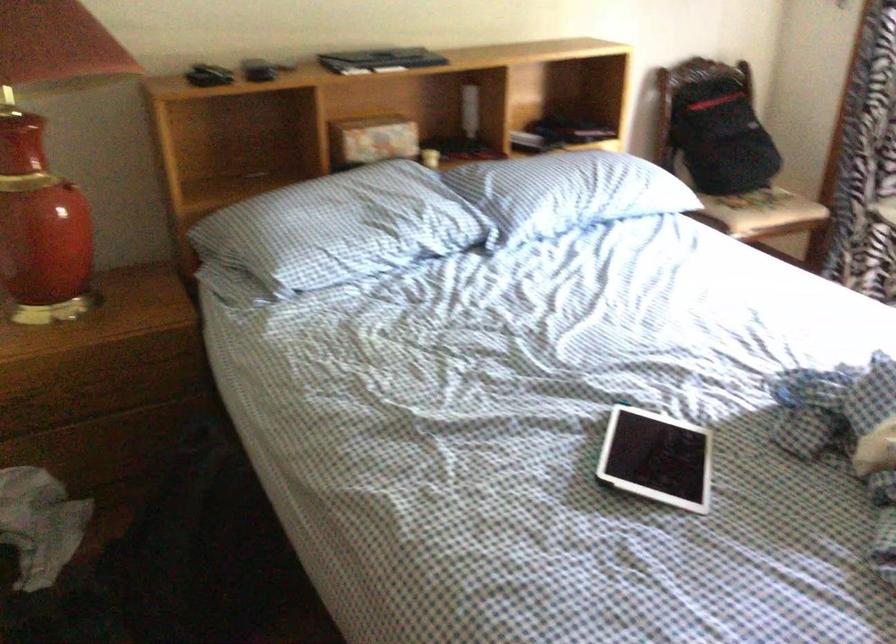
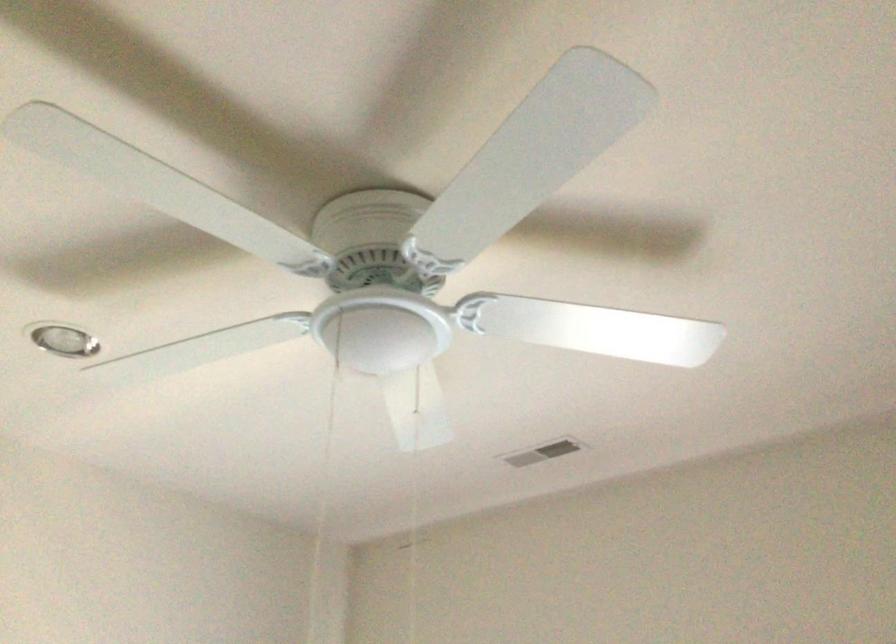
How did the camera likely rotate?

The rotation direction of the camera is right-up.